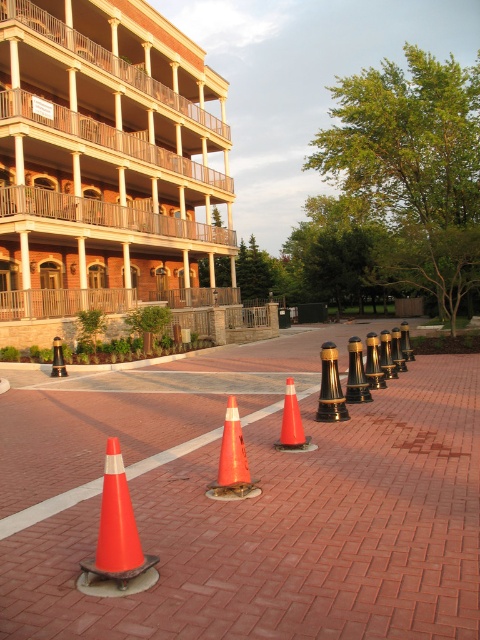
Is orange matte/cone at lower left above orange matte traffic cone at center?

No.

Is orange matte/cone at lower left positioned in front of orange matte traffic cone at center?

That is True.

Does point (118, 580) come closer to viewer compared to point (292, 445)?

Yes, point (118, 580) is closer to viewer.

Identify the location of orange matte/cone at lower left. coord(117,540).

Does orange cone at center appear over orange matte/cone at lower left?

Incorrect, orange cone at center is not positioned above orange matte/cone at lower left.

You are a GUI agent. You are given a task and a screenshot of the screen. Output one action in this format:
    pyautogui.click(x=<x>, y=<y>)
    Task: Click on the orange cone at center
    The height and width of the screenshot is (640, 480).
    Given the screenshot: What is the action you would take?
    pyautogui.click(x=255, y=515)

You are a GUI agent. You are given a task and a screenshot of the screen. Output one action in this format:
    pyautogui.click(x=<x>, y=<y>)
    Task: Click on the orange cone at center
    The height and width of the screenshot is (640, 480).
    Given the screenshot: What is the action you would take?
    pyautogui.click(x=255, y=515)

Between orange cone at center and orange matte/cone at center, which one has less height?

orange cone at center is shorter.

Image resolution: width=480 pixels, height=640 pixels. What are the coordinates of `orange cone at center` in the screenshot? It's located at (255, 515).